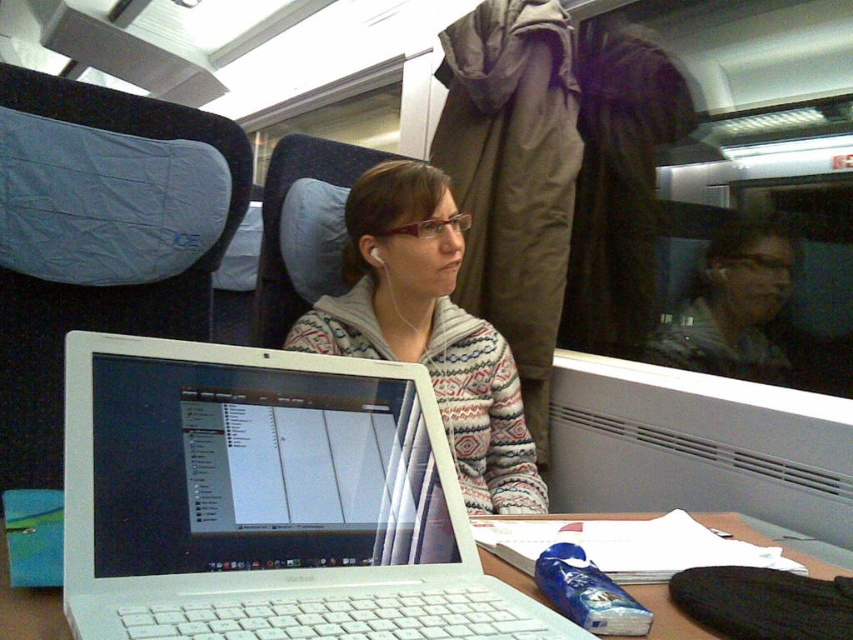
What are the coordinates of the white plastic laptop at center?

The coordinates of the white plastic laptop at center are at point (267, 500).

What are the coordinates of the white plastic laptop at center?

The white plastic laptop at center is located at coordinates point (267, 500).